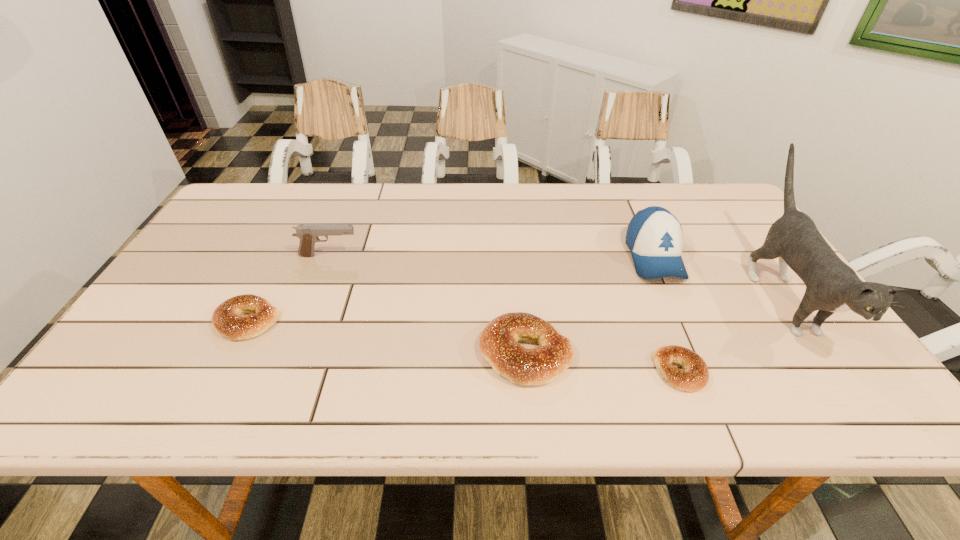
Find the location of a particular element. This screenshot has width=960, height=540. the leftmost bagel is located at coordinates (226, 318).

The width and height of the screenshot is (960, 540). Find the location of `the second shortest bagel`. the second shortest bagel is located at coordinates (226, 318).

I want to click on the fourth tallest object, so click(498, 341).

Image resolution: width=960 pixels, height=540 pixels. What are the coordinates of `the second bagel from right to left` in the screenshot? It's located at (498, 341).

Locate an element on the screen. The height and width of the screenshot is (540, 960). the shortest bagel is located at coordinates (695, 376).

Where is `the rightmost bagel`? Image resolution: width=960 pixels, height=540 pixels. the rightmost bagel is located at coordinates (695, 376).

This screenshot has height=540, width=960. Identify the location of the third tallest object. (308, 234).

This screenshot has width=960, height=540. What are the coordinates of `baseball cap` in the screenshot? It's located at (654, 236).

Image resolution: width=960 pixels, height=540 pixels. What are the coordinates of `cat` in the screenshot? It's located at (832, 286).

The image size is (960, 540). I want to click on the rightmost object, so click(832, 286).